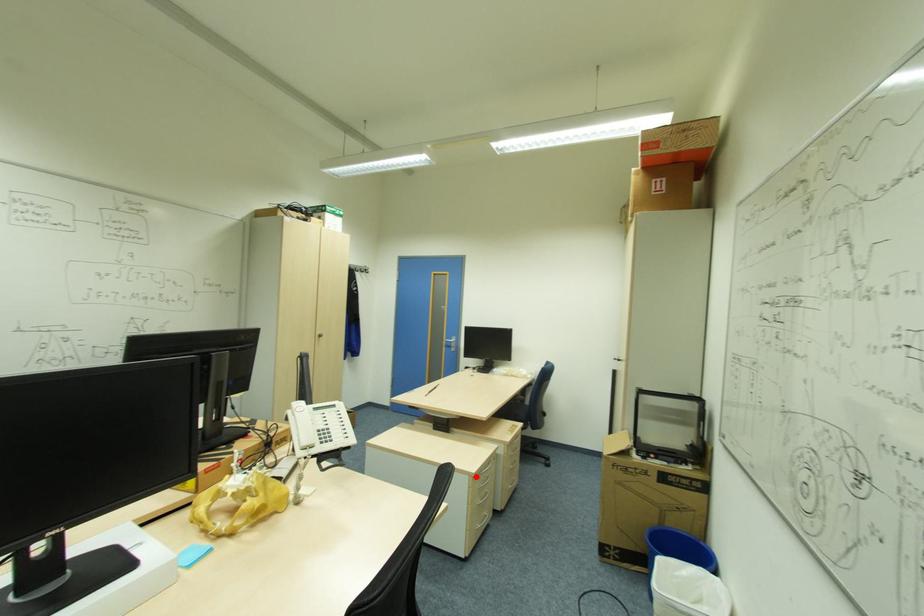
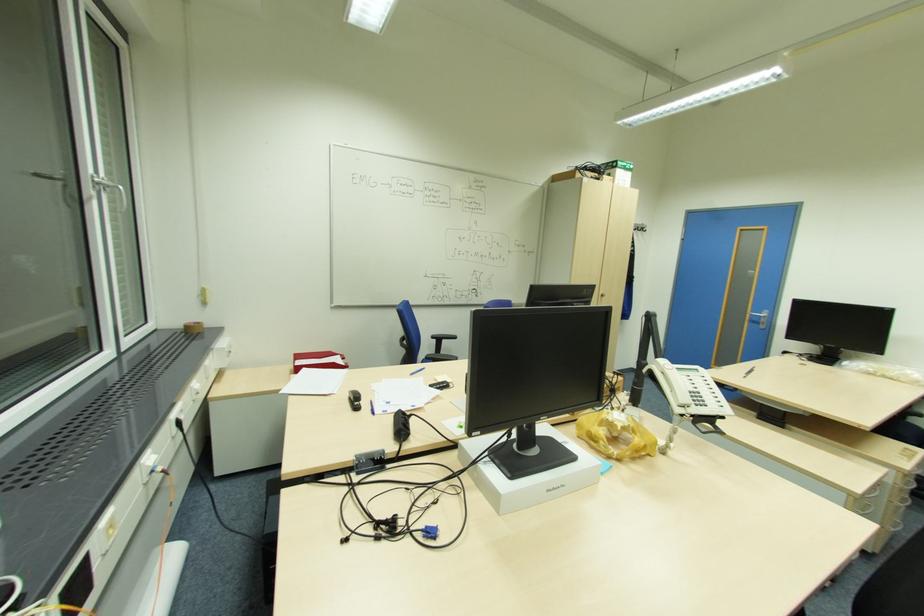
Question: I am providing you with two images of the same scene from different viewpoints. A red point is shown in image1. For the corresponding object point in image2, is it positioned nearer or farther from the camera?

Choices:
 (A) Nearer
 (B) Farther

Answer: (B)